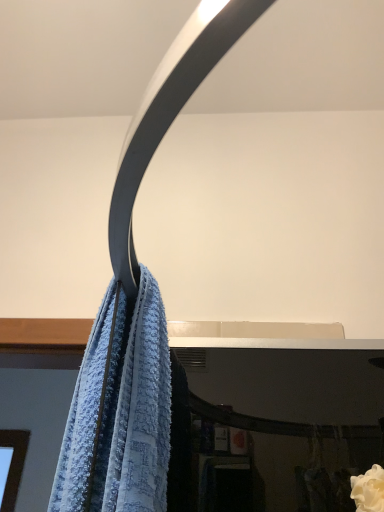
The width and height of the screenshot is (384, 512). Describe the element at coordinates (369, 490) in the screenshot. I see `white matte flower at lower right` at that location.

Identify the location of white matte flower at lower right. The width and height of the screenshot is (384, 512). (369, 490).

Where is `white matte flower at lower right`? white matte flower at lower right is located at coordinates (369, 490).